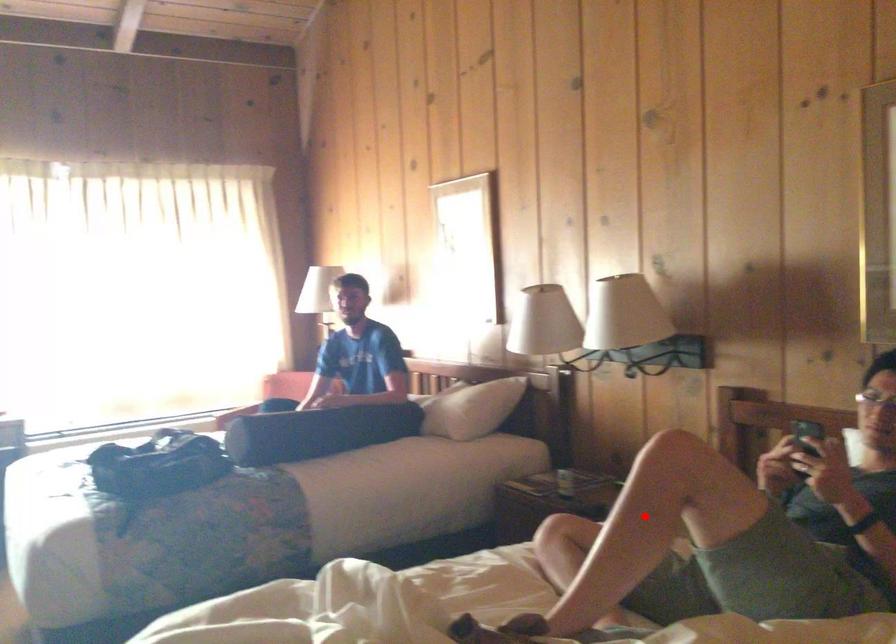
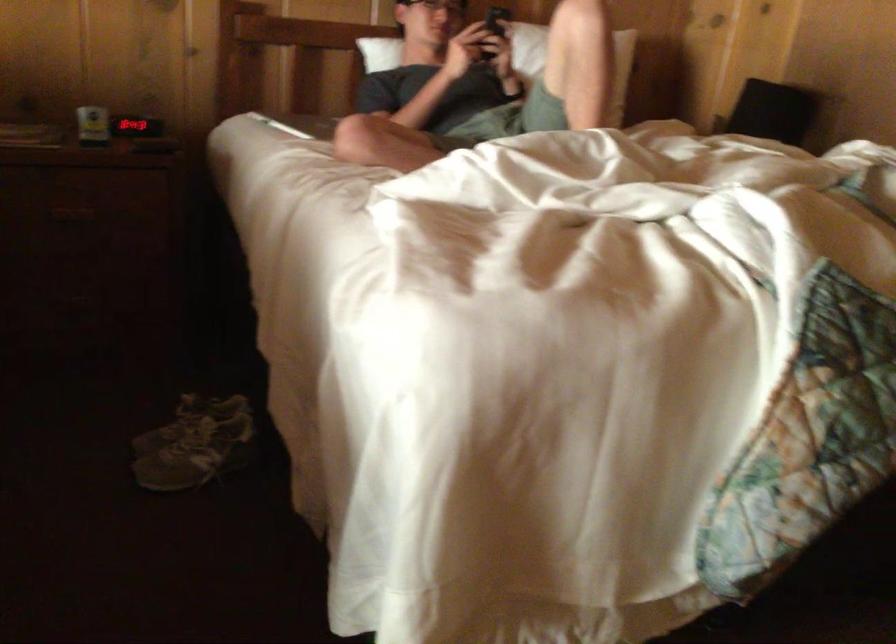
Question: I am providing you with two images of the same scene from different viewpoints. A red point is marked on the first image. Is the red point's position out of view in image 2?

Choices:
 (A) Yes
 (B) No

Answer: (B)